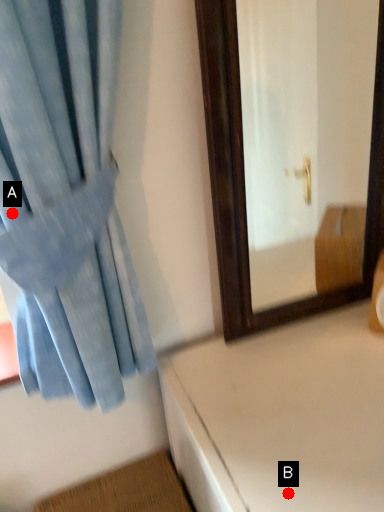
Question: Two points are circled on the image, labeled by A and B beside each circle. Which point is further to the camera?

Choices:
 (A) A is further
 (B) B is further

Answer: (B)